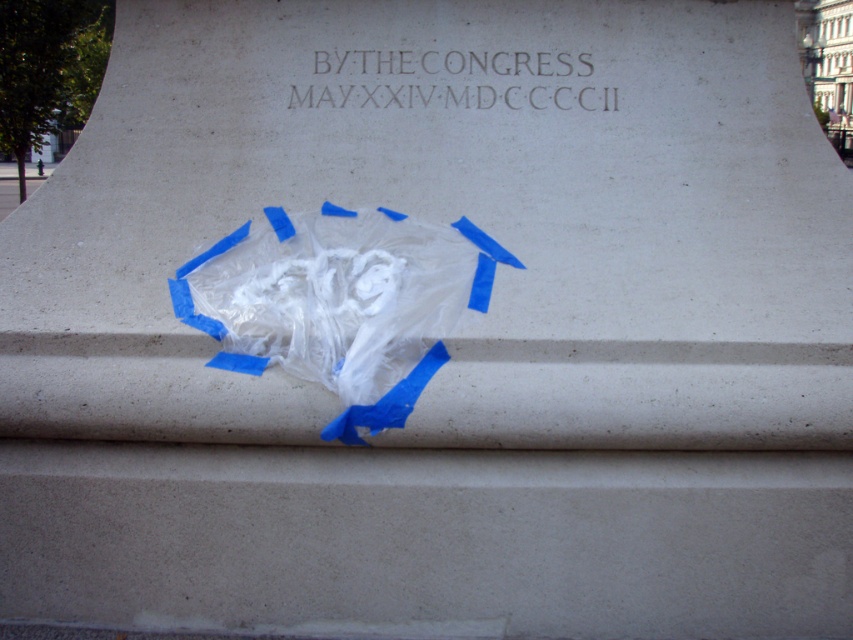
You are a historian examining the monument. You notice the translucent plastic bag at center and the dark gray stone inscription at upper center. Which object is larger in size?

The translucent plastic bag at center is bigger than the dark gray stone inscription at upper center.

You are standing in front of the monument and notice two points marked on its surface. The first point is at coordinate point (260, 240) and the second is at point (572, 100). Which point is closer to you?

Point (260, 240) is closer to the viewer than point (572, 100).